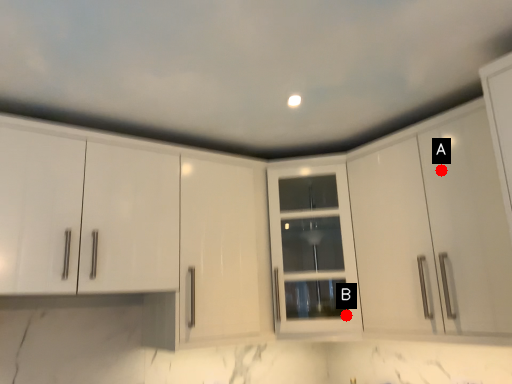
Question: Two points are circled on the image, labeled by A and B beside each circle. Which point is closer to the camera?

Choices:
 (A) A is closer
 (B) B is closer

Answer: (A)